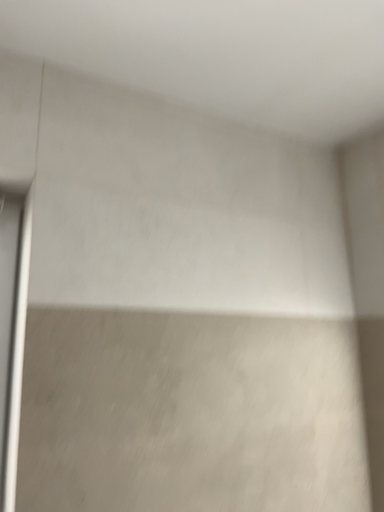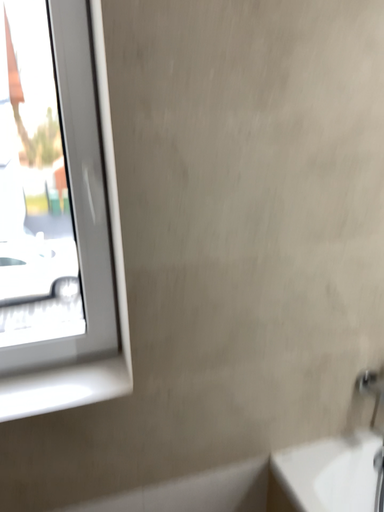
Question: Which way did the camera rotate in the video?

Choices:
 (A) rotated upward
 (B) rotated downward

Answer: (B)